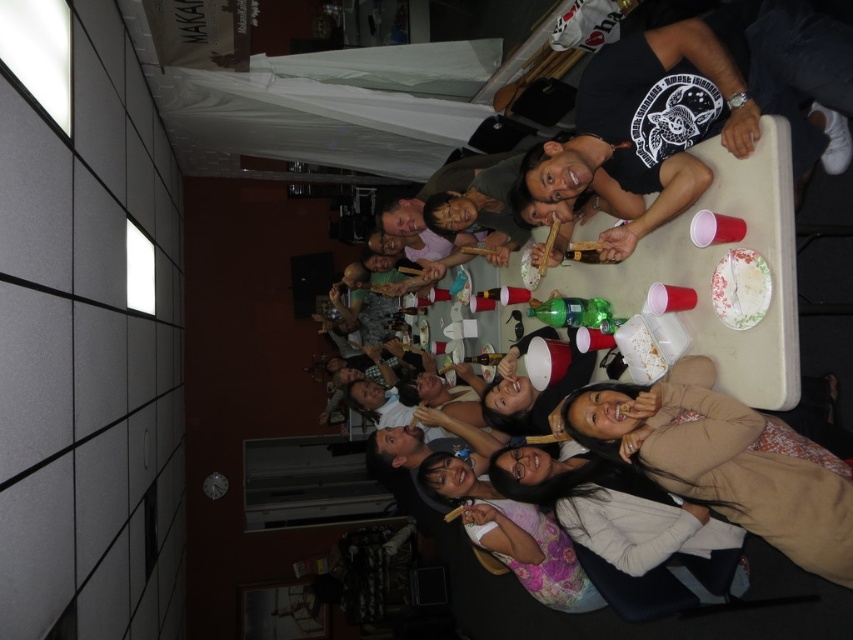
Can you confirm if matte black t-shirt at upper right is thinner than floral paper plate at upper right?

No.

Can you confirm if matte black t-shirt at upper right is wider than floral paper plate at upper right?

Yes, matte black t-shirt at upper right is wider than floral paper plate at upper right.

You are a GUI agent. You are given a task and a screenshot of the screen. Output one action in this format:
    pyautogui.click(x=<x>, y=<y>)
    Task: Click on the matte black t-shirt at upper right
    Image resolution: width=853 pixels, height=640 pixels.
    Given the screenshot: What is the action you would take?
    pyautogui.click(x=694, y=106)

Is point (741, 312) positioned before point (639, 339)?

Yes, it is.

Between floral paper plate at upper right and white paper plate at upper center, which one appears on the right side from the viewer's perspective?

floral paper plate at upper right is more to the right.

What do you see at coordinates (740, 289) in the screenshot?
I see `floral paper plate at upper right` at bounding box center [740, 289].

In order to click on floral paper plate at upper right in this screenshot , I will do `click(740, 289)`.

Does matte black t-shirt at upper right appear on the right side of light brown sweater at lower right?

No, matte black t-shirt at upper right is not to the right of light brown sweater at lower right.

Can you confirm if matte black t-shirt at upper right is positioned above light brown sweater at lower right?

Yes, matte black t-shirt at upper right is above light brown sweater at lower right.

What do you see at coordinates (694, 106) in the screenshot? I see `matte black t-shirt at upper right` at bounding box center [694, 106].

What are the coordinates of `matte black t-shirt at upper right` in the screenshot? It's located at (694, 106).